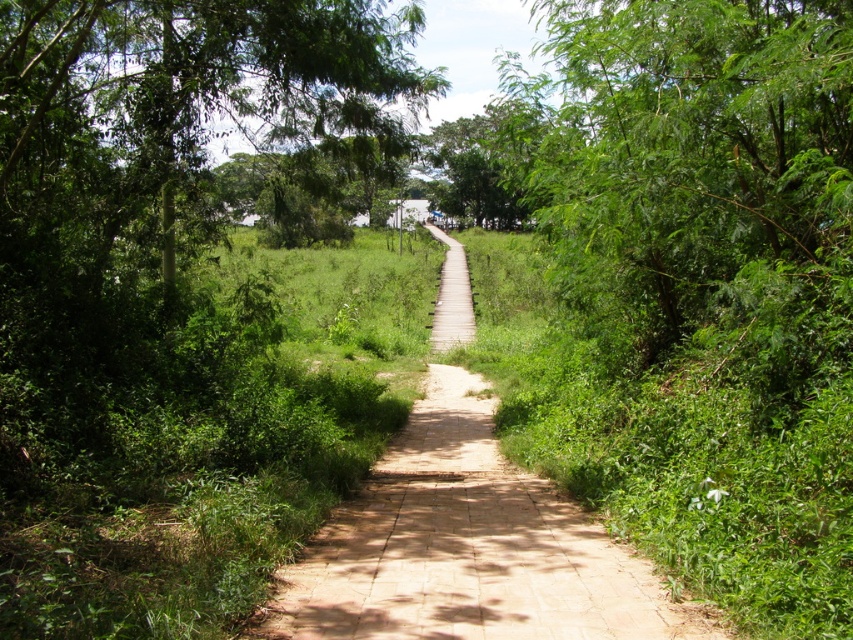
Who is positioned more to the right, green leafy tree at upper right or green leafy tree at upper left?

Positioned to the right is green leafy tree at upper right.

Which is in front, point (751, 54) or point (399, 29)?

Point (751, 54)

Who is more forward, [740,209] or [200,99]?

Point [740,209] is more forward.

Image resolution: width=853 pixels, height=640 pixels. In order to click on green leafy tree at upper right in this screenshot , I will do `click(697, 179)`.